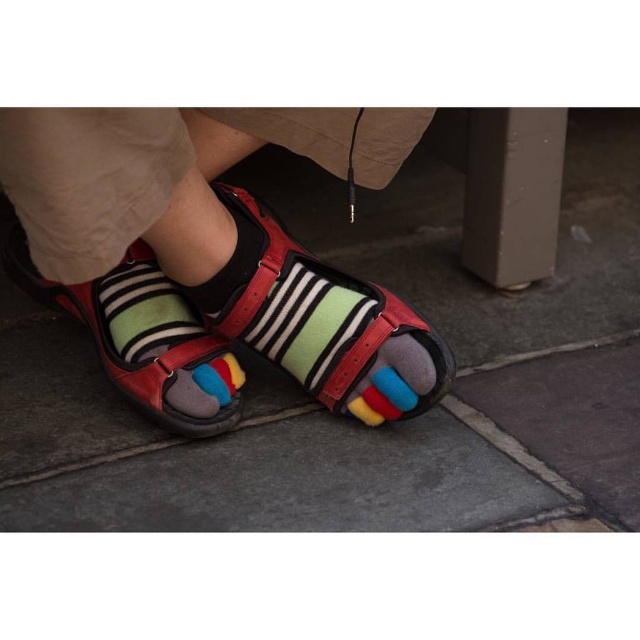
Question: Which is farther from the leather sandals at center?

Choices:
 (A) multicolored wool socks at center
 (B) leather sandal at center

Answer: (B)

Question: Does leather sandal at center appear on the right side of leather sandals at center?

Choices:
 (A) yes
 (B) no

Answer: (A)

Question: Is multicolored wool socks at center thinner than leather sandal at center?

Choices:
 (A) no
 (B) yes

Answer: (A)

Question: Among these points, which one is nearest to the camera?

Choices:
 (A) (236, 401)
 (B) (336, 364)

Answer: (B)

Question: Is leather sandal at center positioned at the back of leather sandals at center?

Choices:
 (A) yes
 (B) no

Answer: (B)

Question: Estimate the real-world distances between objects in this image. Which object is closer to the leather sandal at center?

Choices:
 (A) multicolored wool socks at center
 (B) leather sandals at center

Answer: (A)